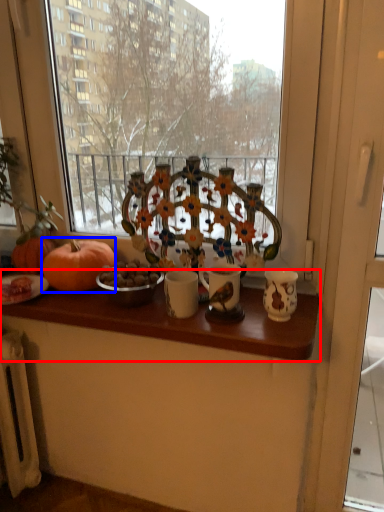
Question: Which of the following is the farthest to the observer, table (highlighted by a red box) or pumpkin (highlighted by a blue box)?

Choices:
 (A) table
 (B) pumpkin

Answer: (B)